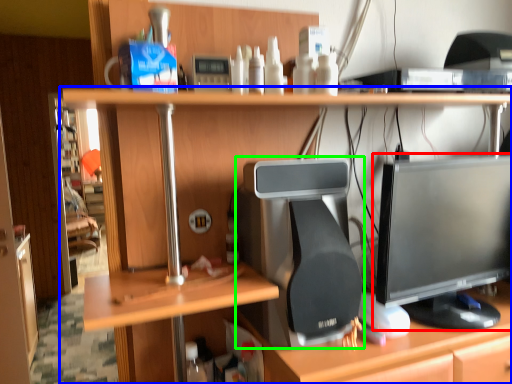
Question: Which object is positioned closest to computer monitor (highlighted by a red box)? Select from desk (highlighted by a blue box) and desktop computer (highlighted by a green box).

Choices:
 (A) desk
 (B) desktop computer

Answer: (B)